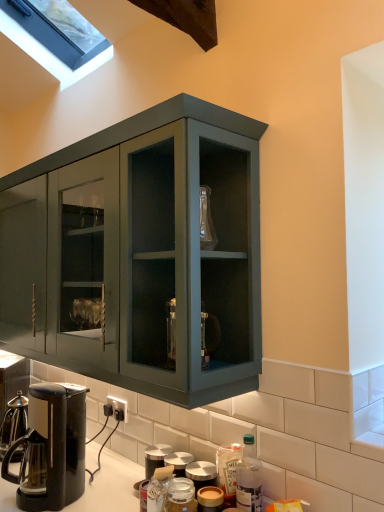
Question: Does translucent plastic bottle at lower center, which is the second bottle in right-to-left order, turn towards clear glass window at upper left?

Choices:
 (A) no
 (B) yes

Answer: (A)

Question: Is translucent plastic bottle at lower center, the 2th bottle from the left, completely or partially outside of clear glass window at upper left?

Choices:
 (A) no
 (B) yes

Answer: (B)

Question: From a real-world perspective, does translucent plastic bottle at lower center, the 2th bottle from the left, stand above clear glass window at upper left?

Choices:
 (A) yes
 (B) no

Answer: (B)

Question: Is translucent plastic bottle at lower center, the 2th bottle from the left, smaller than clear glass window at upper left?

Choices:
 (A) yes
 (B) no

Answer: (A)

Question: Considering the relative sizes of translucent plastic bottle at lower center, which is the second bottle in right-to-left order, and clear glass window at upper left in the image provided, is translucent plastic bottle at lower center, which is the second bottle in right-to-left order, bigger than clear glass window at upper left?

Choices:
 (A) yes
 (B) no

Answer: (B)

Question: From their relative heights in the image, would you say black glossy coffee maker at lower left is taller or shorter than clear glass window at upper left?

Choices:
 (A) short
 (B) tall

Answer: (A)

Question: Based on their sizes in the image, would you say black glossy coffee maker at lower left is bigger or smaller than clear glass window at upper left?

Choices:
 (A) small
 (B) big

Answer: (A)

Question: From a real-world perspective, relative to clear glass window at upper left, is black glossy coffee maker at lower left vertically above or below?

Choices:
 (A) above
 (B) below

Answer: (B)

Question: Is point (46, 446) closer or farther from the camera than point (16, 26)?

Choices:
 (A) farther
 (B) closer

Answer: (B)

Question: Is point (216, 480) closer or farther from the camera than point (248, 476)?

Choices:
 (A) closer
 (B) farther

Answer: (B)

Question: In terms of width, does translucent plastic bottle at lower center, which is the second bottle in right-to-left order, look wider or thinner when compared to translucent plastic bottle at lower center, which is counted as the first bottle, starting from the right?

Choices:
 (A) wide
 (B) thin

Answer: (A)

Question: From a real-world perspective, is translucent plastic bottle at lower center, which is the second bottle in right-to-left order, above or below translucent plastic bottle at lower center, which is the third bottle in left-to-right order?

Choices:
 (A) below
 (B) above

Answer: (A)

Question: Looking at the image, does translucent plastic bottle at lower center, which is the second bottle in right-to-left order, seem bigger or smaller compared to translucent plastic bottle at lower center, which is the third bottle in left-to-right order?

Choices:
 (A) big
 (B) small

Answer: (A)

Question: Considering the positions of point (218, 459) and point (173, 500), is point (218, 459) closer or farther from the camera than point (173, 500)?

Choices:
 (A) farther
 (B) closer

Answer: (A)

Question: From a real-world perspective, is translucent plastic bottle at lower center, the 2th bottle from the left, positioned above or below translucent glass jar at lower center, which ranks as the third bottle in right-to-left order?

Choices:
 (A) below
 (B) above

Answer: (B)